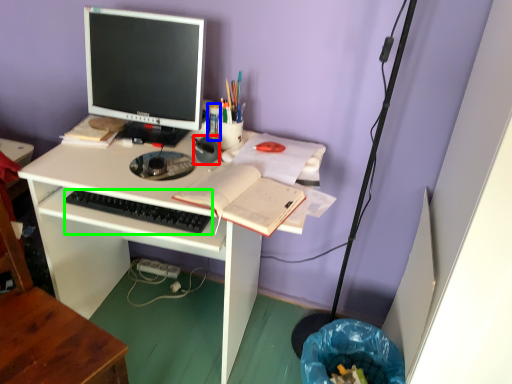
Question: Which is nearer to the stationery (highlighted by a red box)? stationery (highlighted by a blue box) or computer keyboard (highlighted by a green box).

Choices:
 (A) stationery
 (B) computer keyboard

Answer: (A)